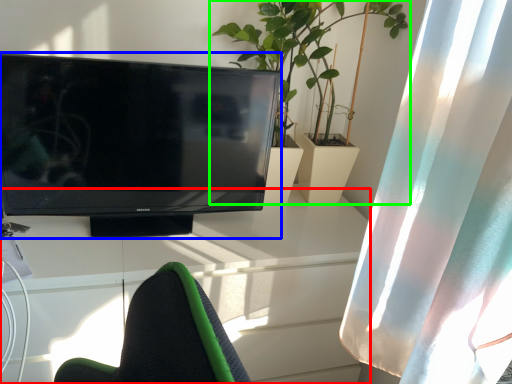
Question: Considering the real-world distances, which object is farthest from desk (highlighted by a red box)? television (highlighted by a blue box) or houseplant (highlighted by a green box)?

Choices:
 (A) television
 (B) houseplant

Answer: (B)